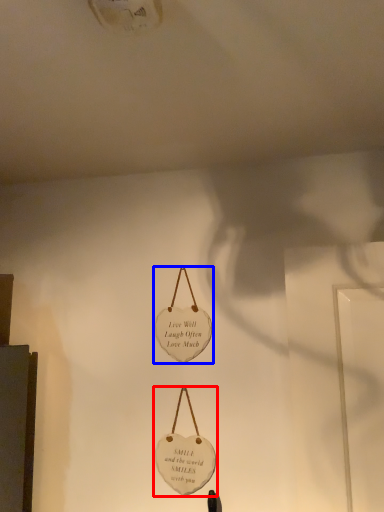
Question: Which object is closer to the camera taking this photo, handbag (highlighted by a red box) or handbag (highlighted by a blue box)?

Choices:
 (A) handbag
 (B) handbag

Answer: (A)